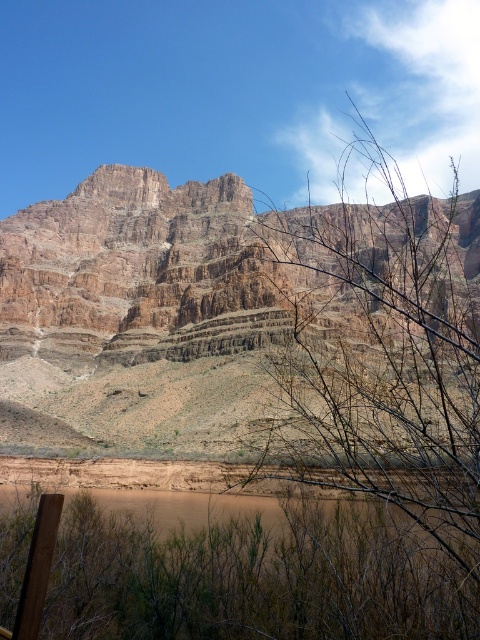
Question: Is brown leafless branches at center positioned behind brown matte lake at lower left?

Choices:
 (A) no
 (B) yes

Answer: (B)

Question: Can you confirm if brown leafless branches at center is positioned above brown matte lake at lower left?

Choices:
 (A) no
 (B) yes

Answer: (B)

Question: Observing the image, what is the correct spatial positioning of brown rocky mountain at upper center in reference to brown matte lake at lower left?

Choices:
 (A) above
 (B) below

Answer: (A)

Question: Among these points, which one is nearest to the camera?

Choices:
 (A) (387, 572)
 (B) (478, 234)
 (C) (158, 508)

Answer: (A)

Question: Which object is closer to the camera taking this photo?

Choices:
 (A) brown leafless branches at center
 (B) brown rocky mountain at upper center
 (C) brown matte lake at lower left

Answer: (C)

Question: Which object appears farthest from the camera in this image?

Choices:
 (A) brown matte lake at lower left
 (B) brown rocky mountain at upper center

Answer: (B)